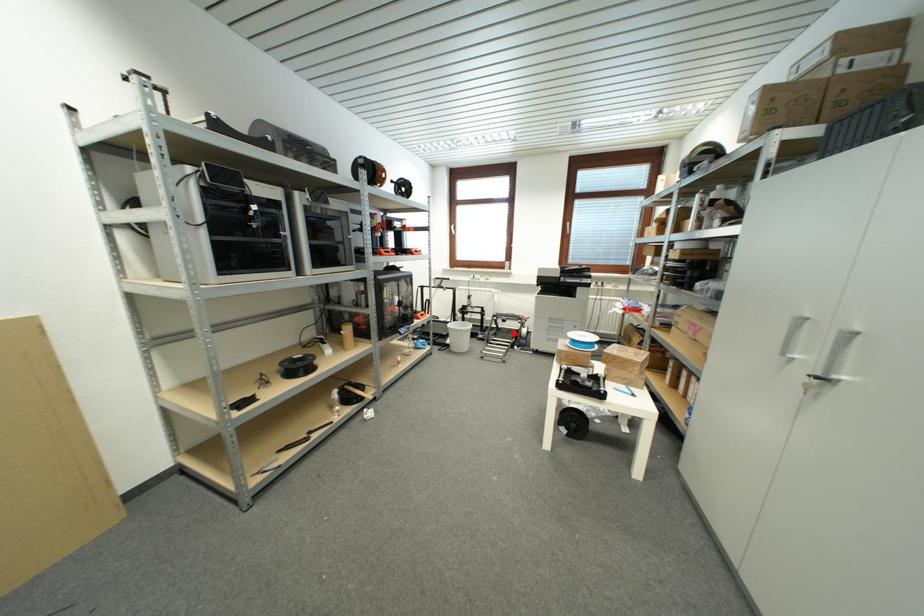
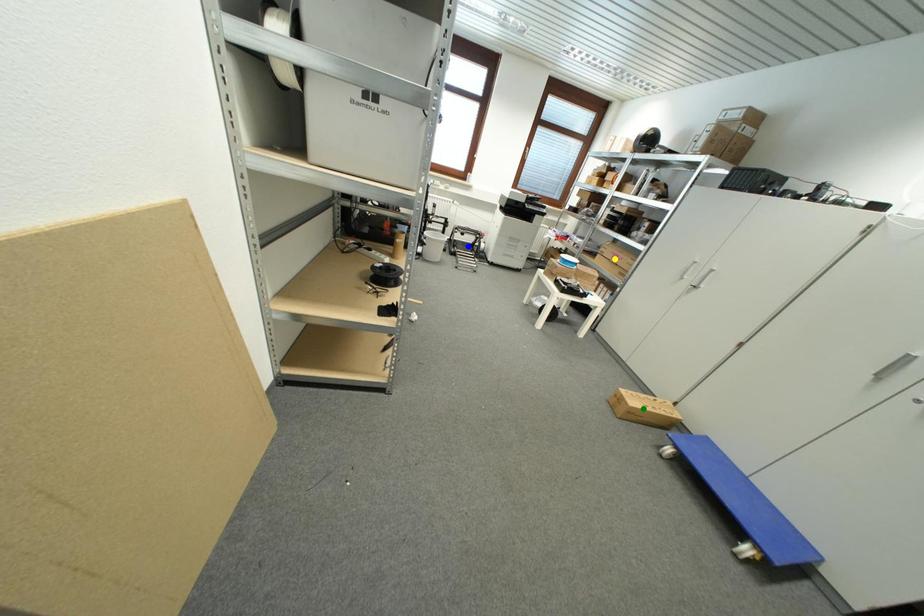
Question: I am providing you with two images of the same scene from different viewpoints. A red point is marked on the first image. You are given multiple points on the second image. Which point in image 2 is actually the same real-world point as the red point in image 1?

Choices:
 (A) blue point
 (B) yellow point
 (C) green point

Answer: (A)